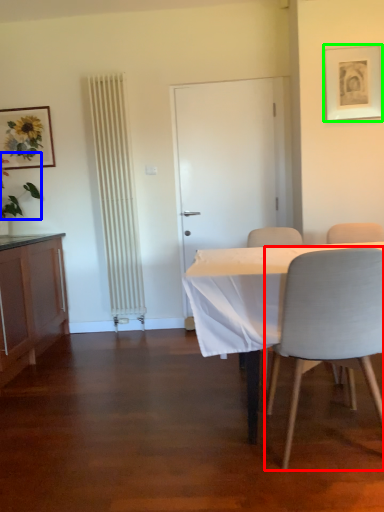
Question: Considering the real-world distances, which object is farthest from chair (highlighted by a red box)? plant (highlighted by a blue box) or picture frame (highlighted by a green box)?

Choices:
 (A) plant
 (B) picture frame

Answer: (A)